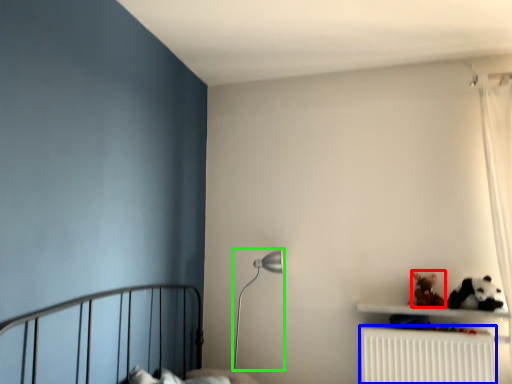
Question: Which object is positioned farthest from toy (highlighted by a red box)? Select from radiator (highlighted by a blue box) and table lamp (highlighted by a green box).

Choices:
 (A) radiator
 (B) table lamp

Answer: (B)